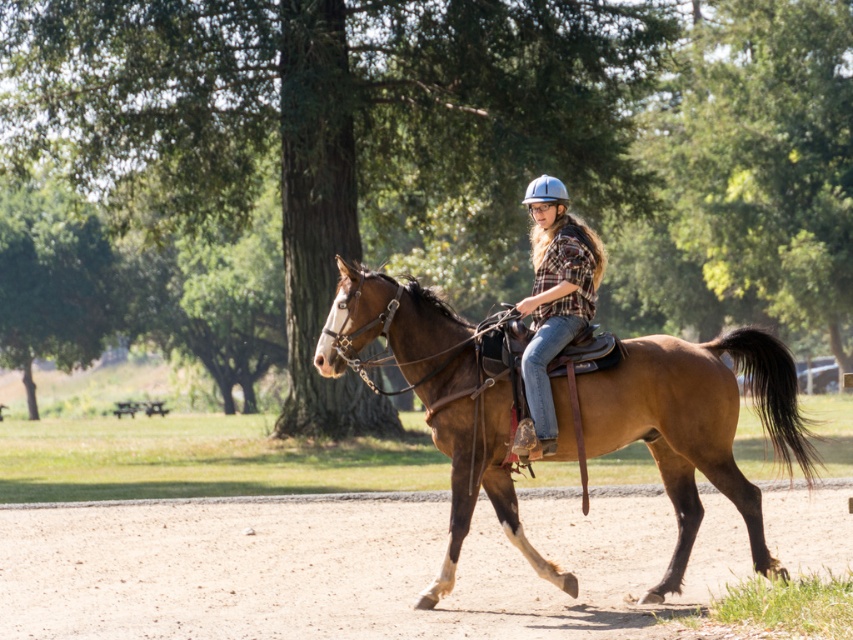
You are a photographer positioned at the edge of the scene. You want to capture a photo of the plaid fabric shirt at center while ensuring the brown dirt track at lower center is visible in the background. Which direction should you adjust your camera to frame the shot properly?

The brown dirt track at lower center is to the left of the plaid fabric shirt at center, so you should adjust your camera to the right to include both the plaid fabric shirt at center and the brown dirt track at lower center in the frame.

From the picture: You are a drone operator trying to capture a photo of the rider and horse. The rider and horse are located at point (517,528) and point (552,202) respectively. To ensure both are in frame, you need to position the drone so that the rider is centered. Since the rider is in front of the horse, will the horse still be visible in the photo if the drone is positioned directly above the rider?

Yes, the horse will still be visible because point (517,528) is in front of point (552,202), meaning the rider is closer to the drone than the horse. Positioning the drone above the rider would still allow the horse to be in the background of the photo.

You are a photographer trying to capture a closeup of the plaid fabric shirt at center while ensuring the brown leather saddle at center is also visible in the frame. Given their sizes, which object should you focus on to ensure both are in the shot?

The brown leather saddle at center is wider than the plaid fabric shirt at center, so focusing on the saddle will allow both objects to fit within the frame.